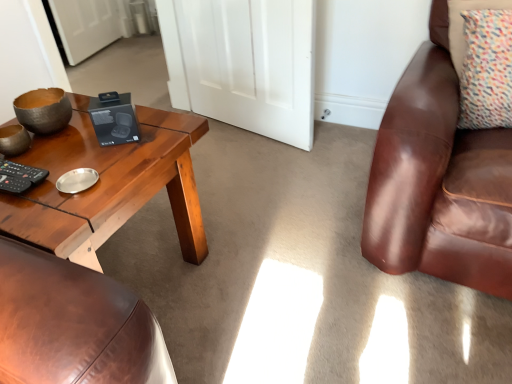
Question: Considering the relative sizes of woodenmaterial/texturecoffee table at left and multicolored fabric pillow at upper right in the image provided, is woodenmaterial/texturecoffee table at left smaller than multicolored fabric pillow at upper right?

Choices:
 (A) no
 (B) yes

Answer: (A)

Question: Is woodenmaterial/texturecoffee table at left wider than multicolored fabric pillow at upper right?

Choices:
 (A) no
 (B) yes

Answer: (B)

Question: From a real-world perspective, is woodenmaterial/texturecoffee table at left located higher than multicolored fabric pillow at upper right?

Choices:
 (A) no
 (B) yes

Answer: (A)

Question: From a real-world perspective, is woodenmaterial/texturecoffee table at left located beneath multicolored fabric pillow at upper right?

Choices:
 (A) yes
 (B) no

Answer: (A)

Question: Considering the relative positions of woodenmaterial/texturecoffee table at left and multicolored fabric pillow at upper right in the image provided, is woodenmaterial/texturecoffee table at left to the left of multicolored fabric pillow at upper right from the viewer's perspective?

Choices:
 (A) yes
 (B) no

Answer: (A)

Question: Based on their sizes in the image, would you say white matte door at center is bigger or smaller than woodenmaterial/texturecoffee table at left?

Choices:
 (A) small
 (B) big

Answer: (A)

Question: Is white matte door at center to the left or to the right of woodenmaterial/texturecoffee table at left in the image?

Choices:
 (A) left
 (B) right

Answer: (B)

Question: Looking at their shapes, would you say white matte door at center is wider or thinner than woodenmaterial/texturecoffee table at left?

Choices:
 (A) wide
 (B) thin

Answer: (B)

Question: Is point [188, 39] closer or farther from the camera than point [50, 150]?

Choices:
 (A) closer
 (B) farther

Answer: (B)

Question: From a real-world perspective, is white matte door at center positioned above or below multicolored fabric pillow at upper right?

Choices:
 (A) below
 (B) above

Answer: (A)

Question: From the image's perspective, is white matte door at center positioned above or below multicolored fabric pillow at upper right?

Choices:
 (A) below
 (B) above

Answer: (B)

Question: Relative to multicolored fabric pillow at upper right, is white matte door at center in front or behind?

Choices:
 (A) behind
 (B) front

Answer: (A)

Question: Does point (291, 61) appear closer or farther from the camera than point (478, 26)?

Choices:
 (A) closer
 (B) farther

Answer: (B)

Question: Considering their positions, is multicolored fabric pillow at upper right located in front of or behind white matte door at center?

Choices:
 (A) front
 (B) behind

Answer: (A)

Question: Would you say multicolored fabric pillow at upper right is inside or outside white matte door at center?

Choices:
 (A) inside
 (B) outside

Answer: (B)